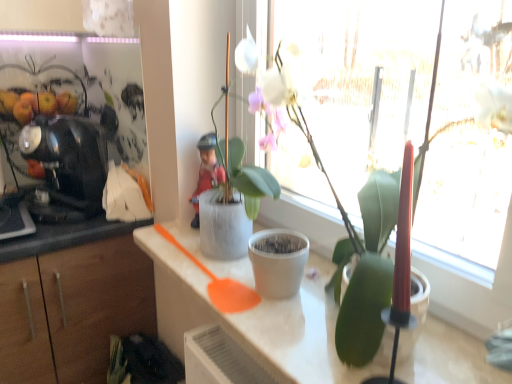
Locate an element on the screen. The width and height of the screenshot is (512, 384). blank space to the left of white matte flowerpot at center is located at coordinates (212, 275).